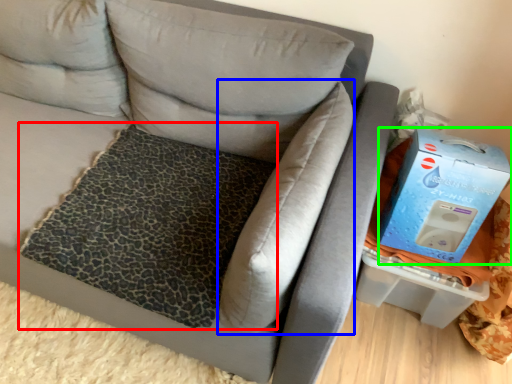
Question: Based on their relative distances, which object is farther from mat (highlighted by a red box)? Choose from pillow (highlighted by a blue box) and box (highlighted by a green box).

Choices:
 (A) pillow
 (B) box

Answer: (B)